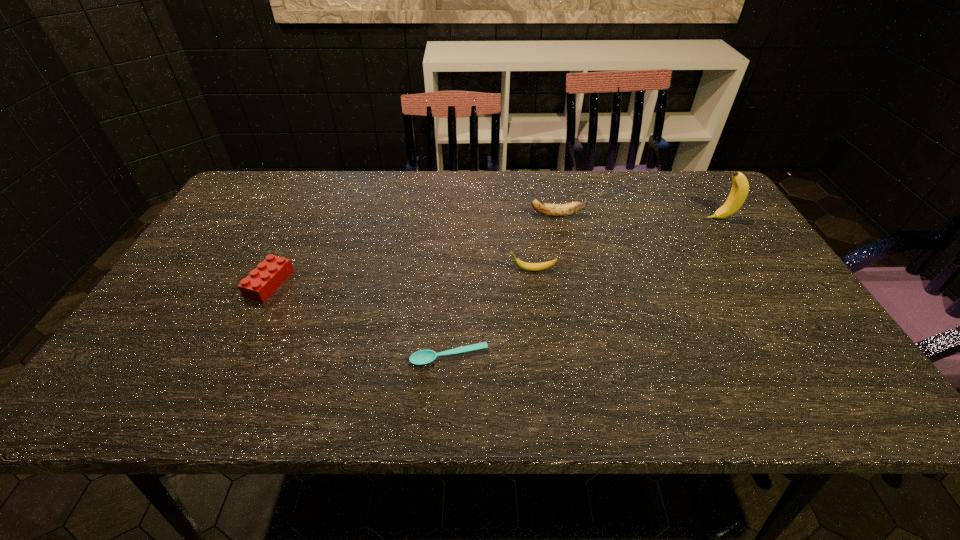
Find the location of a particular element. Image resolution: width=960 pixels, height=540 pixels. the rightmost banana is located at coordinates (740, 188).

Locate an element on the screen. the rightmost object is located at coordinates (740, 188).

At what (x,y) coordinates should I click in order to perform the action: click on the second tallest object. Please return your answer as a coordinate pair (x, y). This screenshot has width=960, height=540. Looking at the image, I should click on (555, 210).

This screenshot has height=540, width=960. In order to click on the third shortest object in this screenshot , I will do `click(522, 265)`.

This screenshot has height=540, width=960. What are the coordinates of `the nearest banana` in the screenshot? It's located at (522, 265).

I want to click on the leftmost object, so (x=268, y=276).

Locate an element on the screen. This screenshot has height=540, width=960. the second shortest object is located at coordinates (268, 276).

Image resolution: width=960 pixels, height=540 pixels. In order to click on spoon in this screenshot , I will do `click(423, 357)`.

Where is `the second object from left to right`? Image resolution: width=960 pixels, height=540 pixels. the second object from left to right is located at coordinates (423, 357).

Find the location of `vacant area situated from the stem of the rightmost object`. vacant area situated from the stem of the rightmost object is located at coordinates (636, 219).